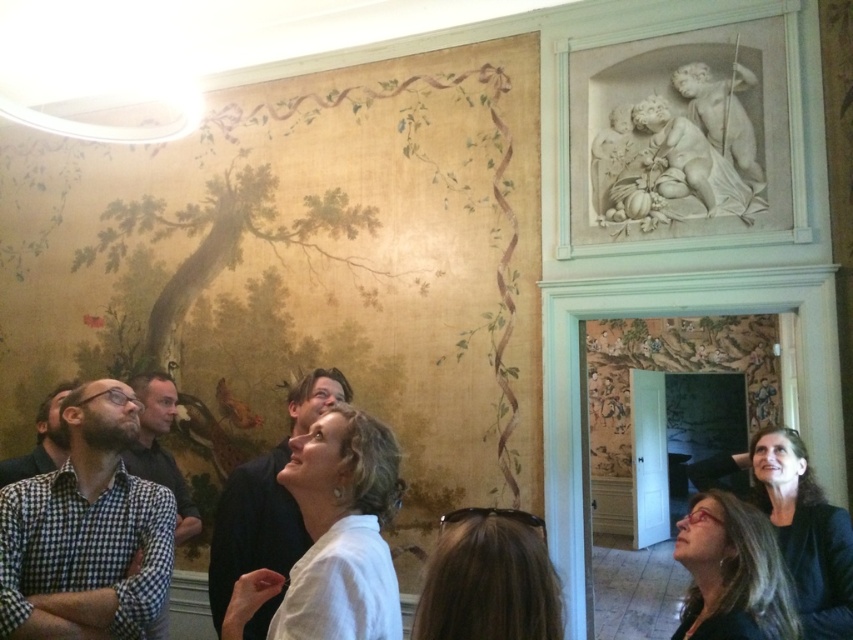
You are a tour guide leading a group in the museum. You notice two visitors with matte black hair at lower right and dark brown hair at left. Which visitor is standing closer to the mural on the wall?

The matte black hair at lower right is positioned under dark brown hair at left, so the visitor with matte black hair at lower right is closer to the mural on the wall.

You are standing in the historical building and notice a person with matte black hair at lower right. Where exactly is this person positioned in relation to the large mural on the wall?

The matte black hair at lower right is located at point 0.897 on the x and 0.859 on the y coordinates, which places it near the lower right corner of the mural.